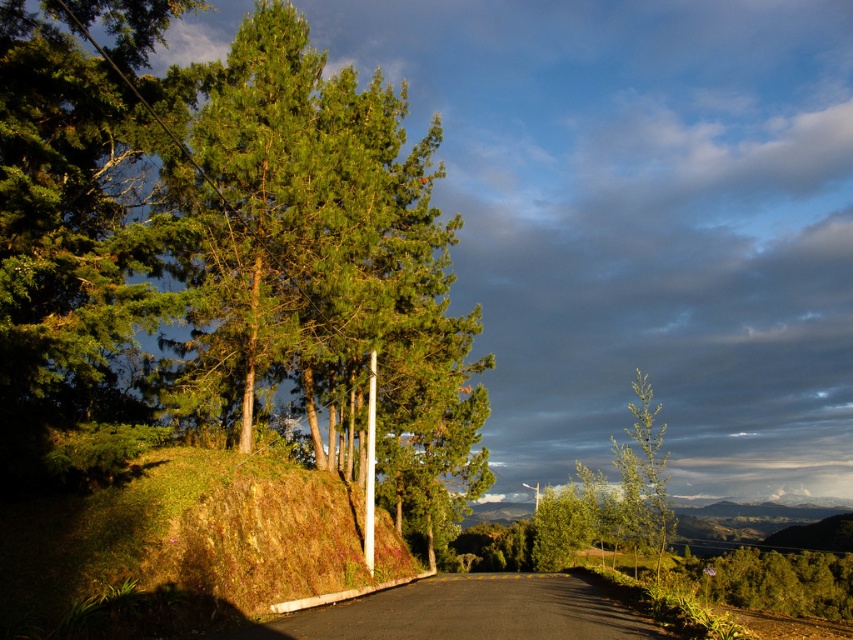
Question: Where is black asphalt road at center located in relation to green leafy tree at right in the image?

Choices:
 (A) below
 (B) above

Answer: (B)

Question: Which point is closer to the camera?

Choices:
 (A) green mossy hillside at left
 (B) green leafy tree at right
 (C) green glossy tree at upper left
 (D) black asphalt road at center

Answer: (C)

Question: Is black asphalt road at center further to camera compared to green leafy tree at right?

Choices:
 (A) no
 (B) yes

Answer: (A)

Question: Which of the following is the closest to the observer?

Choices:
 (A) (30, 579)
 (B) (352, 602)

Answer: (A)

Question: Does black asphalt road at center have a smaller size compared to green leafy tree at right?

Choices:
 (A) no
 (B) yes

Answer: (B)

Question: Which point appears closest to the camera in this image?

Choices:
 (A) (306, 509)
 (B) (97, 205)

Answer: (B)